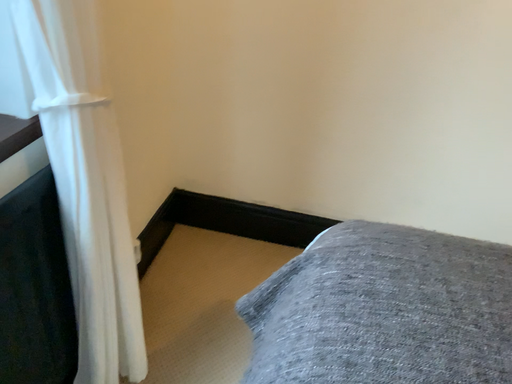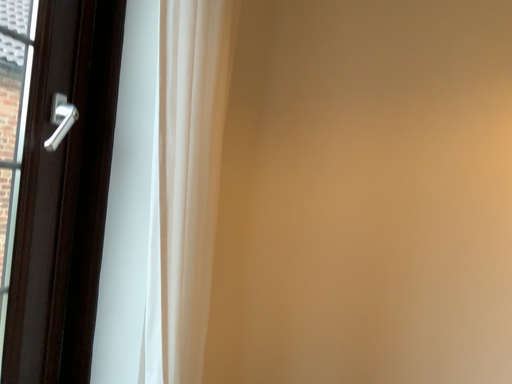
Question: Which way did the camera rotate in the video?

Choices:
 (A) rotated upward
 (B) rotated downward

Answer: (A)